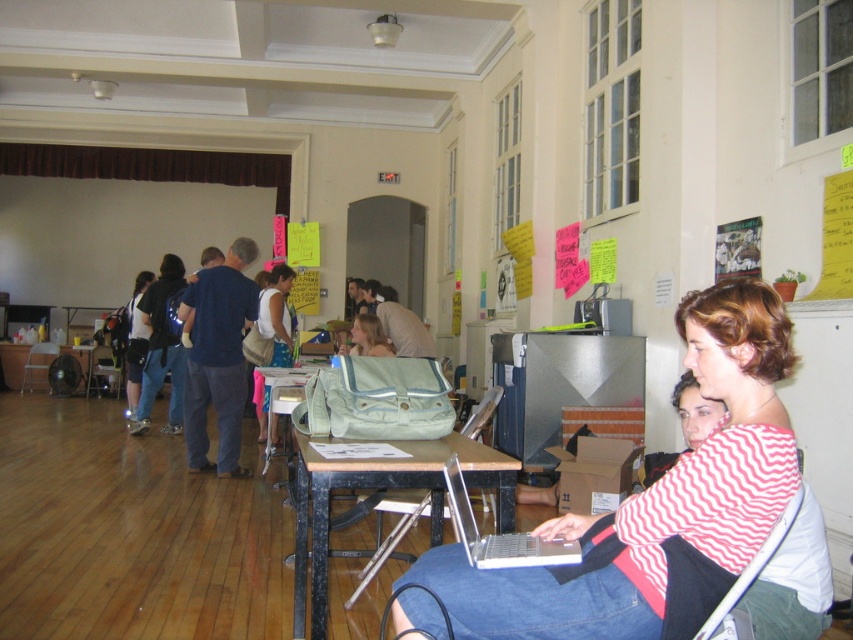
Can you confirm if matte black backpack at center is taller than matte blue backpack at center?

Yes.

This screenshot has height=640, width=853. What do you see at coordinates (136, 342) in the screenshot? I see `matte black backpack at center` at bounding box center [136, 342].

Find the location of a particular element. This screenshot has width=853, height=640. matte black backpack at center is located at coordinates (136, 342).

What do you see at coordinates (379, 490) in the screenshot?
I see `wooden table at center` at bounding box center [379, 490].

Looking at this image, can you confirm if wooden table at center is taller than brown wooden table at lower left?

Yes.

Does point (463, 456) come in front of point (13, 355)?

Yes, point (463, 456) is in front of point (13, 355).

Identify the location of wooden table at center. (379, 490).

At what (x,y) coordinates should I click in order to perform the action: click on striped fabric shirt at center. Please return your answer as a coordinate pair (x, y). The height and width of the screenshot is (640, 853). Looking at the image, I should click on (654, 497).